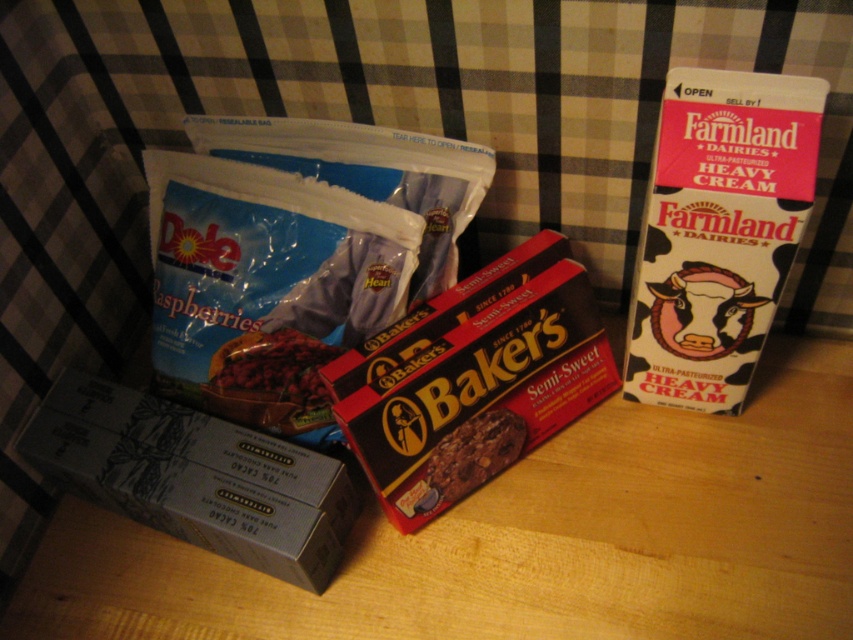
Between matte black chocolate bar at center and matte brown chocolate bar at center, which one is positioned lower?

matte brown chocolate bar at center is below.

Is matte black chocolate bar at center to the left of matte brown chocolate bar at center from the viewer's perspective?

In fact, matte black chocolate bar at center is to the right of matte brown chocolate bar at center.

This screenshot has width=853, height=640. What do you see at coordinates (300, 257) in the screenshot?
I see `matte black chocolate bar at center` at bounding box center [300, 257].

You are a GUI agent. You are given a task and a screenshot of the screen. Output one action in this format:
    pyautogui.click(x=<x>, y=<y>)
    Task: Click on the matte black chocolate bar at center
    
    Given the screenshot: What is the action you would take?
    pyautogui.click(x=300, y=257)

Who is more distant from viewer, [757,179] or [102,483]?

Point [102,483]

Can you confirm if white cardboard box at right is positioned above matte gray box of chocolate at lower left?

Yes.

Is point (717, 355) farther from camera compared to point (331, 570)?

Yes, it is behind point (331, 570).

The width and height of the screenshot is (853, 640). In order to click on white cardboard box at right in this screenshot , I will do `click(718, 230)`.

Does semi-glossy cardboard box of baker's semi-sweet chocolate chips at center have a smaller size compared to chocolate-coated cookie at center?

Incorrect, semi-glossy cardboard box of baker's semi-sweet chocolate chips at center is not smaller in size than chocolate-coated cookie at center.

Can you confirm if semi-glossy cardboard box of baker's semi-sweet chocolate chips at center is positioned above chocolate-coated cookie at center?

Correct, semi-glossy cardboard box of baker's semi-sweet chocolate chips at center is located above chocolate-coated cookie at center.

Locate an element on the screen. semi-glossy cardboard box of baker's semi-sweet chocolate chips at center is located at coordinates (477, 380).